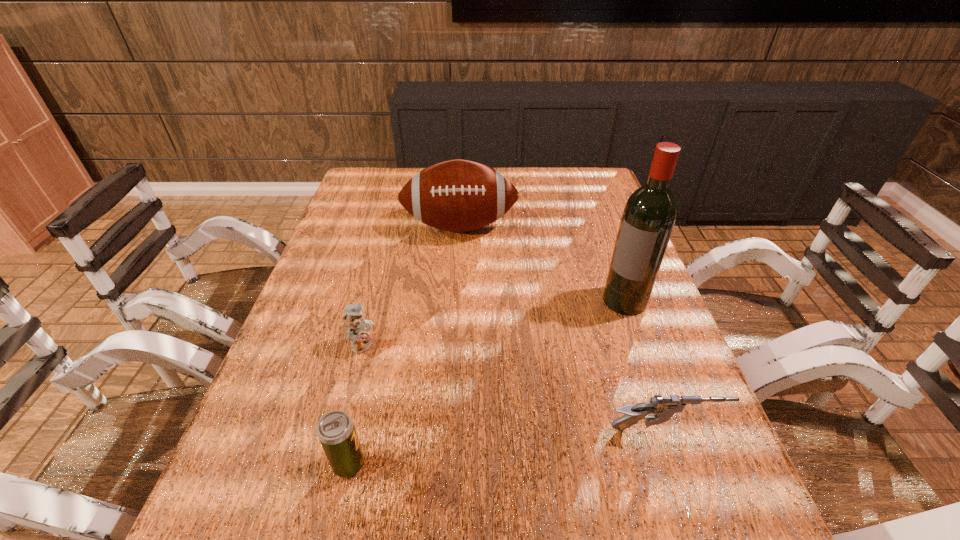
In order to click on wine bottle situated at the right edge in this screenshot , I will do `click(649, 215)`.

Locate an element on the screen. vacant space at the far edge of the desktop is located at coordinates (512, 172).

Image resolution: width=960 pixels, height=540 pixels. In order to click on vacant space at the near edge in this screenshot , I will do `click(574, 467)`.

The image size is (960, 540). In the image, there is a desktop. What are the coordinates of `free space at the left edge` in the screenshot? It's located at (342, 234).

In the image, there is a desktop. Where is `vacant space at the right edge`? vacant space at the right edge is located at coordinates (713, 422).

Locate an element on the screen. vacant region at the far right corner of the desktop is located at coordinates (600, 193).

The image size is (960, 540). Identify the location of free location at the near right corner of the desktop. [645, 444].

Identify the location of free point between the third nearest object and the beer can. The image size is (960, 540). (356, 404).

Image resolution: width=960 pixels, height=540 pixels. I want to click on free space between the gun and the third nearest object, so click(x=514, y=388).

Locate an element on the screen. vacant space that is in between the nearest object and the second nearest object is located at coordinates (507, 447).